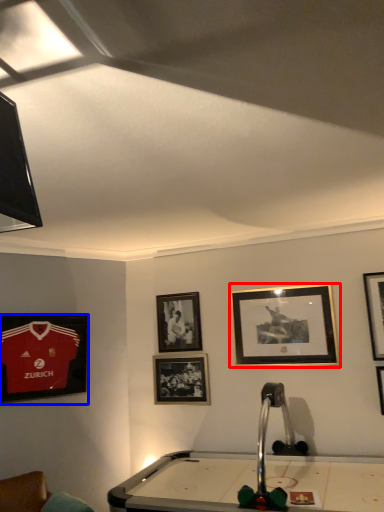
Question: Which object appears farthest to the camera in this image, picture frame (highlighted by a red box) or picture frame (highlighted by a blue box)?

Choices:
 (A) picture frame
 (B) picture frame

Answer: (A)